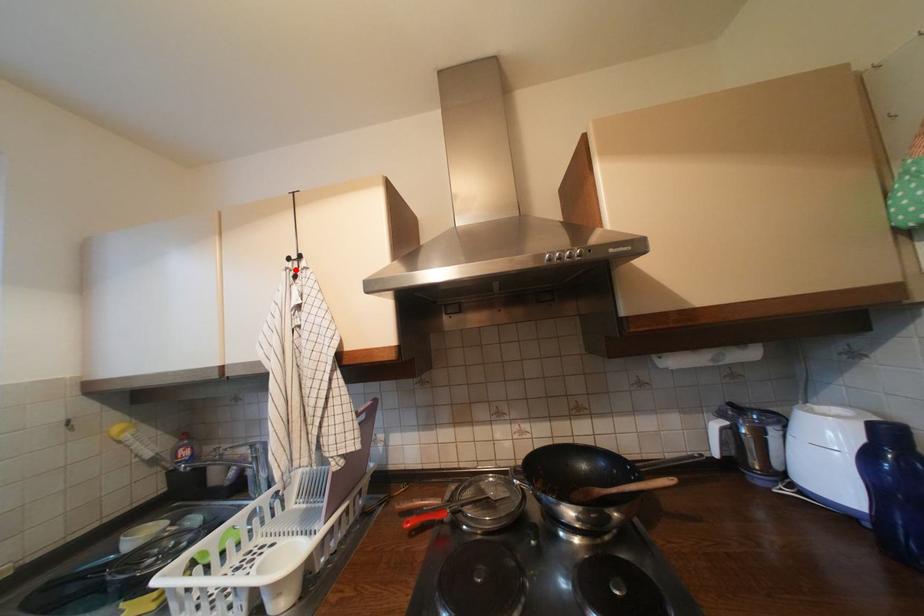
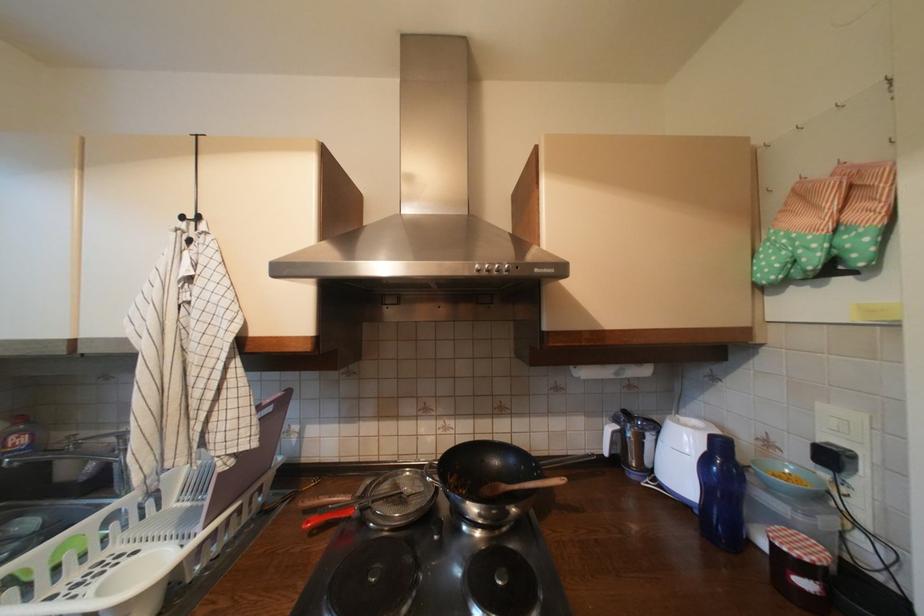
The point at the highlighted location is marked in the first image. Where is the corresponding point in the second image?

(187, 230)